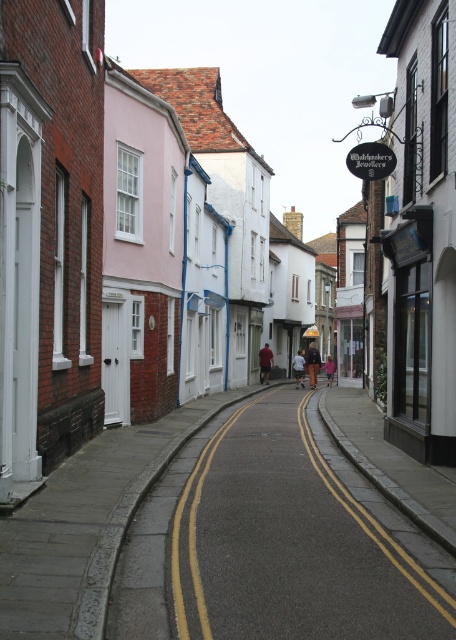
Does smooth asphalt road at center have a larger size compared to dark blue jeans at center?

No.

Is smooth asphalt road at center below dark blue jeans at center?

Yes.

Does point (120, 600) come closer to viewer compared to point (300, 369)?

Yes, it is.

You are a GUI agent. You are given a task and a screenshot of the screen. Output one action in this format:
    pyautogui.click(x=<x>, y=<y>)
    Task: Click on the smooth asphalt road at center
    
    Given the screenshot: What is the action you would take?
    pyautogui.click(x=270, y=545)

Can you confirm if dark brown leather jacket at center is thinner than dark blue jeans at center?

No, dark brown leather jacket at center is not thinner than dark blue jeans at center.

Is point (310, 346) farther from viewer compared to point (298, 380)?

Yes, point (310, 346) is behind point (298, 380).

Is point (316, 374) closer to camera compared to point (298, 352)?

Yes, point (316, 374) is closer to viewer.

Where is `dark brown leather jacket at center`? Image resolution: width=456 pixels, height=640 pixels. dark brown leather jacket at center is located at coordinates (312, 364).

At what (x,y) coordinates should I click in order to perform the action: click on dark blue jeans at center. Please return your answer as a coordinate pair (x, y). The height and width of the screenshot is (640, 456). Looking at the image, I should click on (299, 368).

Does dark blue jeans at center have a lesser width compared to pink fabric at center?

Yes, dark blue jeans at center is thinner than pink fabric at center.

Where is `dark blue jeans at center`? This screenshot has height=640, width=456. dark blue jeans at center is located at coordinates (299, 368).